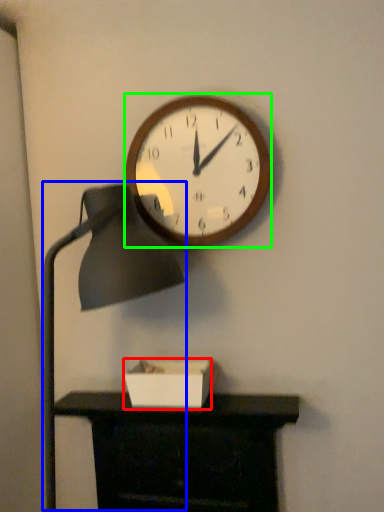
Question: Considering the real-world distances, which object is farthest from box (highlighted by a red box)? table lamp (highlighted by a blue box) or wall clock (highlighted by a green box)?

Choices:
 (A) table lamp
 (B) wall clock

Answer: (B)